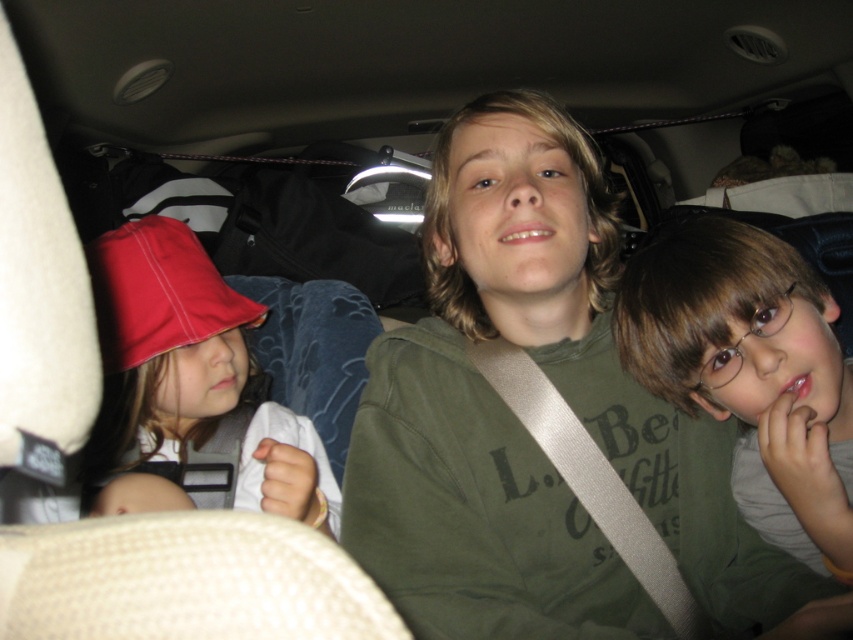
You are a photographer trying to capture a candid shot of the children in the car. You notice a point at coordinate (751, 372). Which child is this point likely indicating?

The point at coordinate (751, 372) corresponds to the matte green shirt at center, which is the child in the center wearing a green hoodie with partially visible text.

Looking at this image, you are sitting in the front passenger seat of the car and want to point out two specific points in the back seat. Which of the two points, point (781,428) or point (241,310), is closer to you?

Point (781,428) is closer to the viewer than point (241,310).

You are a photographer trying to capture a group photo of the three children in the car. You notice the matte green shirt at center and the matte red hat at left. Which child should you focus on first to ensure their entire clothing and accessories are in frame?

You should focus on the matte red hat at left first because it occupies more space than the matte green shirt at center, ensuring it is fully captured in the frame.